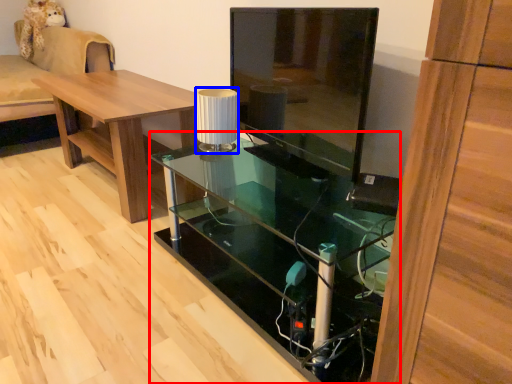
Question: Among these objects, which one is farthest to the camera, desk (highlighted by a red box) or lamp (highlighted by a blue box)?

Choices:
 (A) desk
 (B) lamp

Answer: (B)